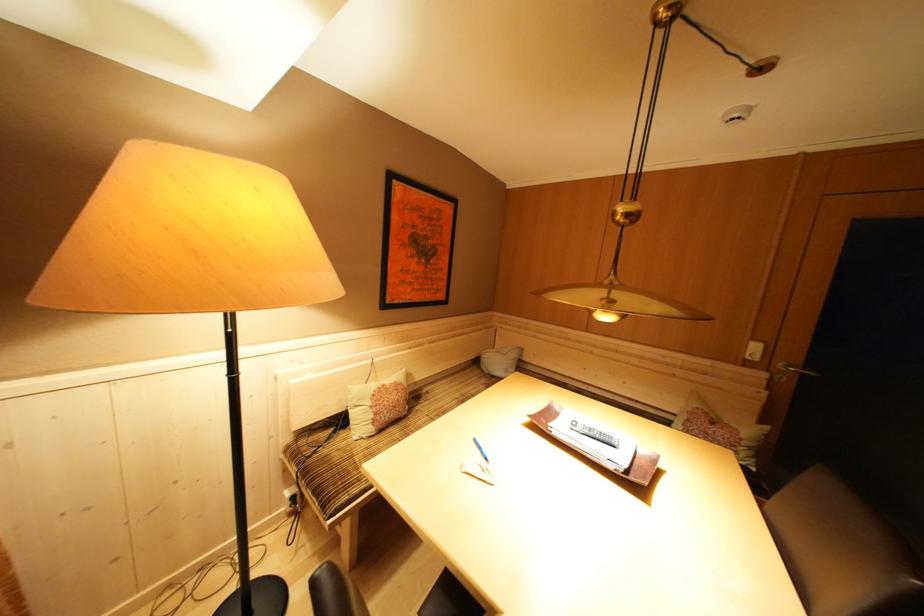
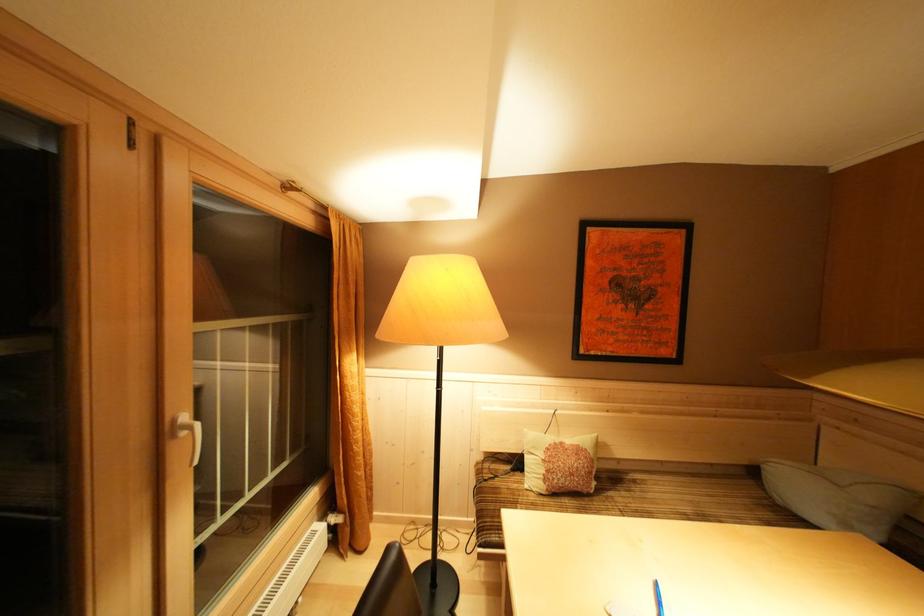
The point at (519, 361) is marked in the first image. Where is the corresponding point in the second image?

(879, 503)